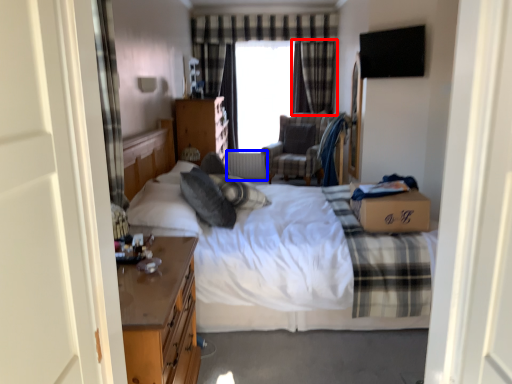
Question: Which object is closer to the camera taking this photo, curtain (highlighted by a red box) or radiator (highlighted by a blue box)?

Choices:
 (A) curtain
 (B) radiator

Answer: (A)